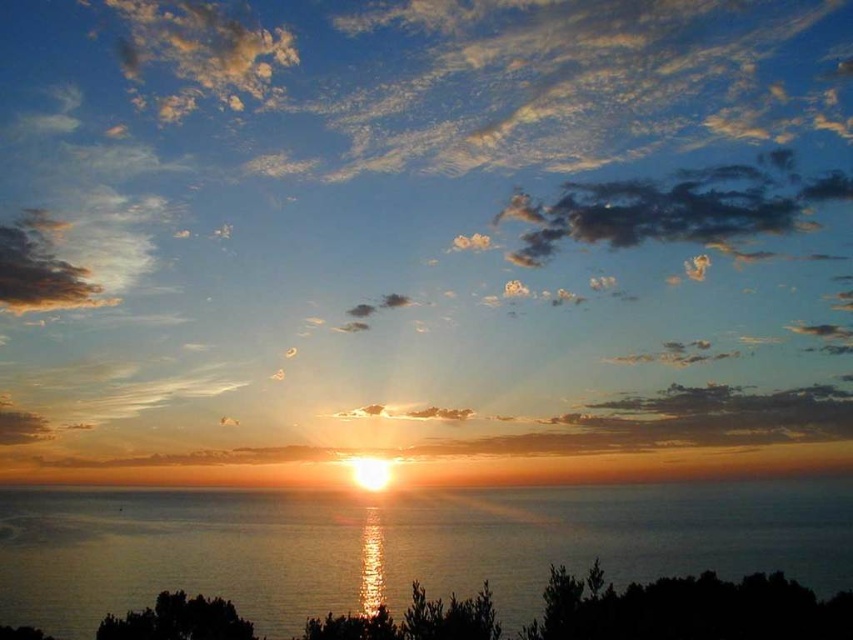
Can you confirm if glistening silver water at center is smaller than dark gray fluffy cloud at upper center?

No.

Who is lower down, glistening silver water at center or dark gray fluffy cloud at upper center?

glistening silver water at center

You are a GUI agent. You are given a task and a screenshot of the screen. Output one action in this format:
    pyautogui.click(x=<x>, y=<y>)
    Task: Click on the glistening silver water at center
    The image size is (853, 640).
    Given the screenshot: What is the action you would take?
    pyautogui.click(x=395, y=541)

Does golden translucent cloud at center have a greater height compared to glistening silver water at center?

Yes.

Is point (572, 4) behind point (144, 548)?

Yes, it is.

Where is `golden translucent cloud at center`? The width and height of the screenshot is (853, 640). golden translucent cloud at center is located at coordinates (422, 236).

Between golden translucent cloud at center and dark gray fluffy cloud at upper center, which one appears on the left side from the viewer's perspective?

Positioned to the left is golden translucent cloud at center.

Can you confirm if golden translucent cloud at center is taller than dark gray fluffy cloud at upper center?

Indeed, golden translucent cloud at center has a greater height compared to dark gray fluffy cloud at upper center.

Which is behind, point (578, 275) or point (648, 192)?

The point (648, 192) is behind.

Identify the location of golden translucent cloud at center. (422, 236).